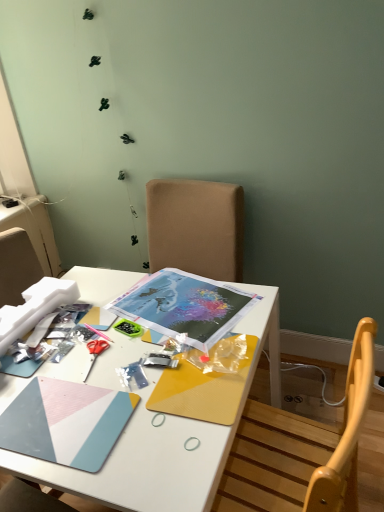
Question: Is point (97, 342) positioned closer to the camera than point (18, 456)?

Choices:
 (A) farther
 (B) closer

Answer: (A)

Question: Is red plastic scissors at center-left situated inside white matte desk at center or outside?

Choices:
 (A) outside
 (B) inside

Answer: (B)

Question: Is red plastic scissors at center-left in front of or behind white matte desk at center in the image?

Choices:
 (A) front
 (B) behind

Answer: (B)

Question: Is point (135, 276) closer or farther from the camera than point (82, 376)?

Choices:
 (A) farther
 (B) closer

Answer: (A)

Question: From a real-world perspective, is white matte desk at center physically located above or below red plastic scissors at center-left?

Choices:
 (A) below
 (B) above

Answer: (A)

Question: From the image's perspective, is white matte desk at center positioned above or below red plastic scissors at center-left?

Choices:
 (A) below
 (B) above

Answer: (A)

Question: Based on their sizes in the image, would you say white matte desk at center is bigger or smaller than red plastic scissors at center-left?

Choices:
 (A) big
 (B) small

Answer: (A)